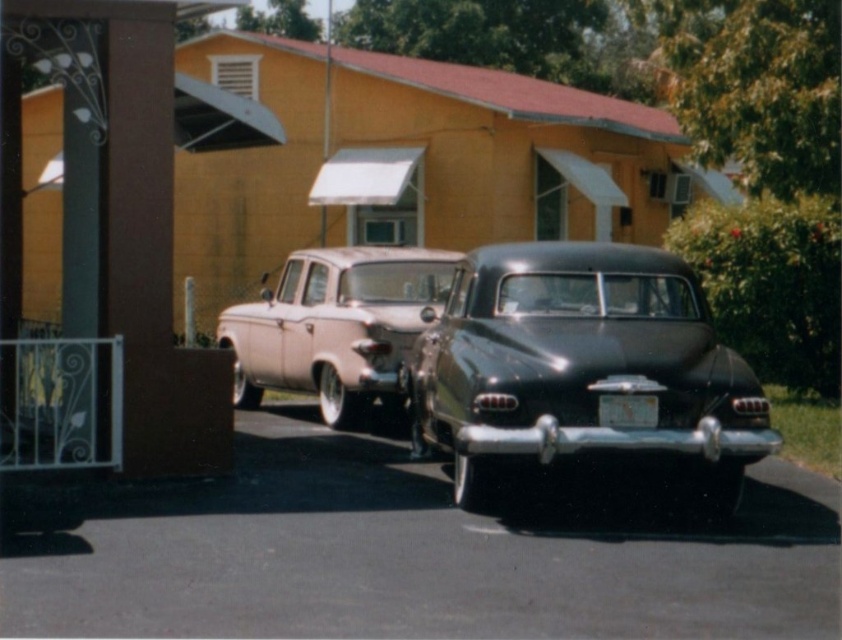
Can you confirm if shiny black sedan at center is positioned below light pink glossy sedan at center?

Correct, shiny black sedan at center is located below light pink glossy sedan at center.

Does shiny black sedan at center have a smaller size compared to light pink glossy sedan at center?

Actually, shiny black sedan at center might be larger than light pink glossy sedan at center.

The image size is (842, 640). In order to click on shiny black sedan at center in this screenshot , I will do `click(582, 371)`.